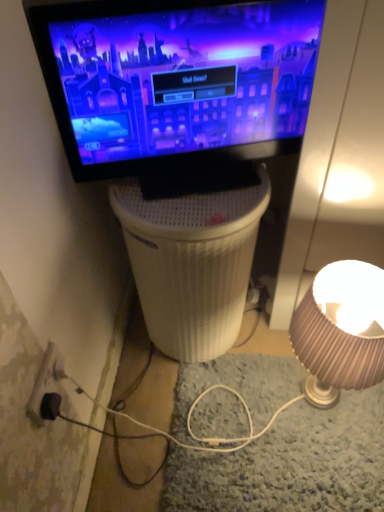
Question: Is black plastic power outlet at lower left closer to camera compared to matte beige lampshade at right?

Choices:
 (A) no
 (B) yes

Answer: (B)

Question: Are black plastic power outlet at lower left and matte beige lampshade at right located far from each other?

Choices:
 (A) no
 (B) yes

Answer: (A)

Question: Considering the relative positions of black plastic power outlet at lower left and matte beige lampshade at right in the image provided, is black plastic power outlet at lower left to the right of matte beige lampshade at right from the viewer's perspective?

Choices:
 (A) no
 (B) yes

Answer: (A)

Question: Could you tell me if black plastic power outlet at lower left is facing matte beige lampshade at right?

Choices:
 (A) yes
 (B) no

Answer: (A)

Question: Can you confirm if black plastic power outlet at lower left is shorter than matte beige lampshade at right?

Choices:
 (A) no
 (B) yes

Answer: (B)

Question: Does point (327, 351) appear closer or farther from the camera than point (38, 387)?

Choices:
 (A) closer
 (B) farther

Answer: (B)

Question: In terms of width, does matte beige lampshade at right look wider or thinner when compared to black plastic power outlet at lower left?

Choices:
 (A) thin
 (B) wide

Answer: (B)

Question: From the image's perspective, relative to black plastic power outlet at lower left, is matte beige lampshade at right above or below?

Choices:
 (A) above
 (B) below

Answer: (A)

Question: Considering their positions, is matte beige lampshade at right located in front of or behind black plastic power outlet at lower left?

Choices:
 (A) front
 (B) behind

Answer: (B)

Question: Visually, is matte beige lampshade at right positioned to the left or to the right of white ribbed plastic at center?

Choices:
 (A) left
 (B) right

Answer: (B)

Question: Is matte beige lampshade at right taller or shorter than white ribbed plastic at center?

Choices:
 (A) tall
 (B) short

Answer: (B)

Question: From the image's perspective, is matte beige lampshade at right above or below white ribbed plastic at center?

Choices:
 (A) below
 (B) above

Answer: (A)

Question: Looking at their shapes, would you say matte beige lampshade at right is wider or thinner than white ribbed plastic at center?

Choices:
 (A) wide
 (B) thin

Answer: (B)

Question: Relative to matte black monitor at upper center, is matte beige lampshade at right in front or behind?

Choices:
 (A) behind
 (B) front

Answer: (A)

Question: Do you think matte beige lampshade at right is within matte black monitor at upper center, or outside of it?

Choices:
 (A) outside
 (B) inside

Answer: (A)